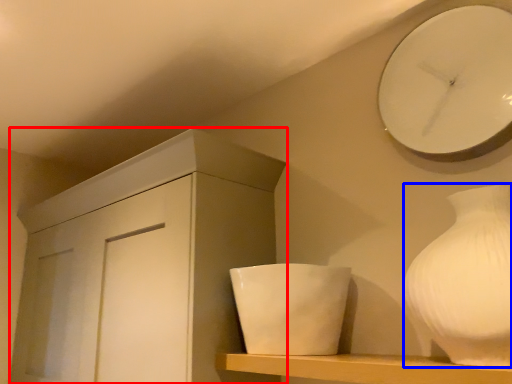
Question: Which object appears farthest to the camera in this image, cabinetry (highlighted by a red box) or vase (highlighted by a blue box)?

Choices:
 (A) cabinetry
 (B) vase

Answer: (A)